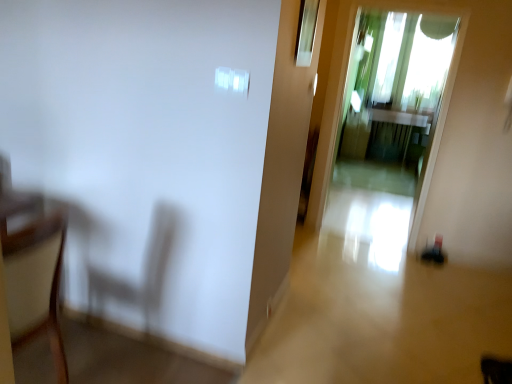
Where is `free point above transparent glass screen door at center (from a real-world perspective)`? The image size is (512, 384). free point above transparent glass screen door at center (from a real-world perspective) is located at coordinates (422, 0).